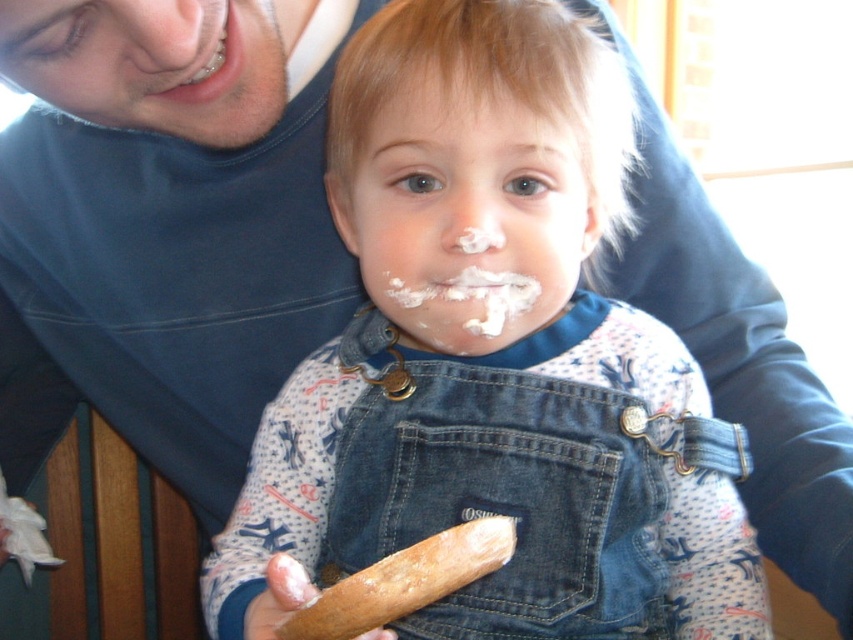
Which is in front, point (415, 474) or point (502, 269)?

Positioned in front is point (502, 269).

Does point (529, 116) come in front of point (444, 212)?

Yes, it is.

Consider the image. Who is more distant from viewer, (469, 433) or (558, 237)?

The point (469, 433) is behind.

This screenshot has height=640, width=853. Identify the location of denim overalls at center. (495, 360).

Is denim overalls at center shorter than matte blue shirt at upper left?

No, denim overalls at center is not shorter than matte blue shirt at upper left.

Does denim overalls at center appear on the right side of matte blue shirt at upper left?

Yes, denim overalls at center is to the right of matte blue shirt at upper left.

Locate an element on the screen. This screenshot has width=853, height=640. denim overalls at center is located at coordinates pyautogui.click(x=495, y=360).

Which is behind, point (381, 305) or point (408, 304)?

The point (381, 305) is behind.

Who is positioned more to the left, white matte face at center or white creamy icing at center?

white matte face at center

Which is in front, point (416, 268) or point (434, 330)?

Point (416, 268) is more forward.

The height and width of the screenshot is (640, 853). I want to click on white matte face at center, so tap(465, 214).